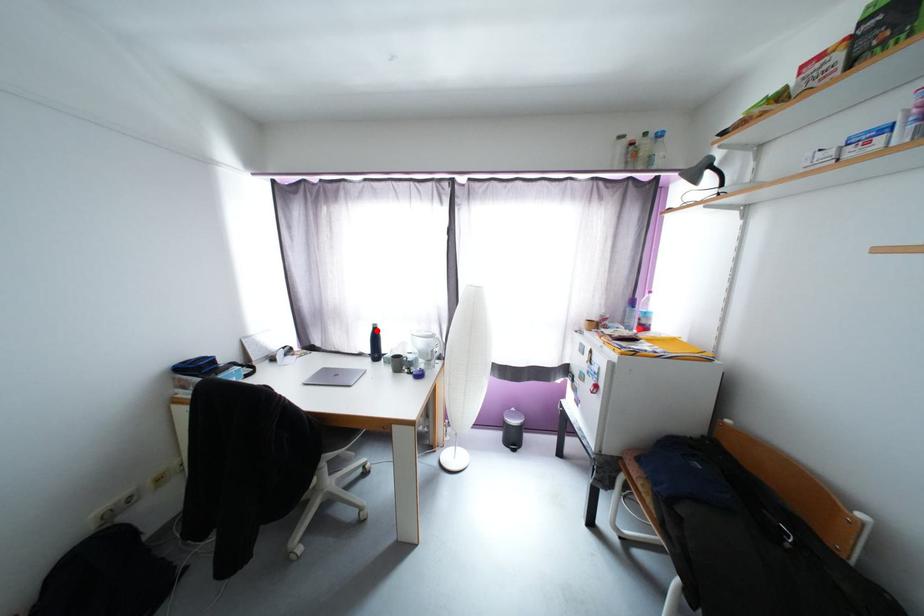
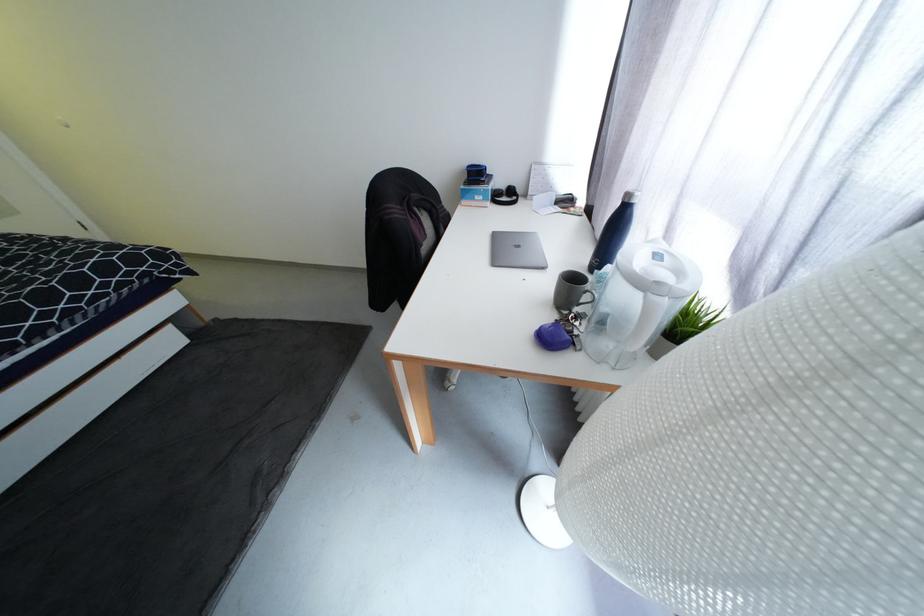
Question: I am providing you with two images of the same scene from different viewpoints. In image1, a red point is highlighted. Considering the same 3D point in image2, which of the following is correct?

Choices:
 (A) It is closer
 (B) It is farther

Answer: (A)